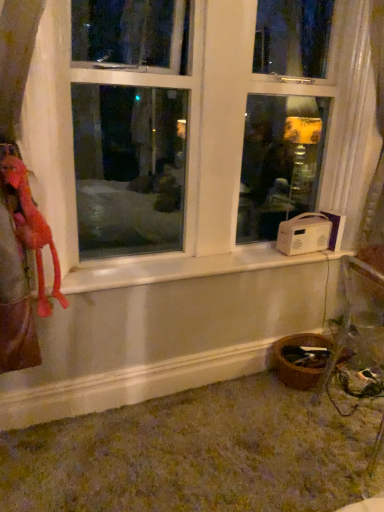
Question: From a real-world perspective, is fluffy pink stuffed animal at left positioned over white plastic window at center based on gravity?

Choices:
 (A) yes
 (B) no

Answer: (B)

Question: Is fluffy pink stuffed animal at left behind white plastic window at center?

Choices:
 (A) yes
 (B) no

Answer: (A)

Question: Is fluffy pink stuffed animal at left oriented towards white plastic window at center?

Choices:
 (A) yes
 (B) no

Answer: (B)

Question: Is fluffy pink stuffed animal at left at the left side of white plastic window at center?

Choices:
 (A) no
 (B) yes

Answer: (B)

Question: Can you see fluffy pink stuffed animal at left touching white plastic window at center?

Choices:
 (A) yes
 (B) no

Answer: (B)

Question: From the image's perspective, is white plastic window at center positioned above or below white sheer curtain at right?

Choices:
 (A) above
 (B) below

Answer: (A)

Question: Considering the positions of point (309, 89) and point (370, 27), is point (309, 89) closer or farther from the camera than point (370, 27)?

Choices:
 (A) farther
 (B) closer

Answer: (A)

Question: Considering their positions, is white plastic window at center located in front of or behind white sheer curtain at right?

Choices:
 (A) front
 (B) behind

Answer: (A)

Question: Considering the positions of white plastic window at center and white sheer curtain at right in the image, is white plastic window at center bigger or smaller than white sheer curtain at right?

Choices:
 (A) small
 (B) big

Answer: (B)

Question: In terms of height, does white sheer curtain at right look taller or shorter compared to fluffy pink stuffed animal at left?

Choices:
 (A) tall
 (B) short

Answer: (A)

Question: From a real-world perspective, is white sheer curtain at right positioned above or below fluffy pink stuffed animal at left?

Choices:
 (A) below
 (B) above

Answer: (B)

Question: Is white sheer curtain at right inside or outside of fluffy pink stuffed animal at left?

Choices:
 (A) outside
 (B) inside

Answer: (A)

Question: Looking at the image, does white sheer curtain at right seem bigger or smaller compared to fluffy pink stuffed animal at left?

Choices:
 (A) big
 (B) small

Answer: (A)

Question: Considering the positions of fluffy pink stuffed animal at left and white plastic window at center in the image, is fluffy pink stuffed animal at left wider or thinner than white plastic window at center?

Choices:
 (A) wide
 (B) thin

Answer: (B)

Question: Is fluffy pink stuffed animal at left in front of or behind white plastic window at center in the image?

Choices:
 (A) front
 (B) behind

Answer: (B)